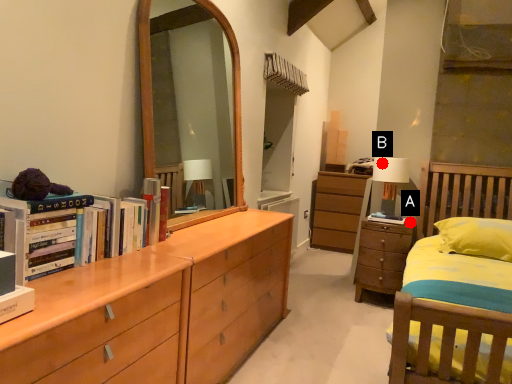
Question: Two points are circled on the image, labeled by A and B beside each circle. Among these points, which one is nearest to the camera?

Choices:
 (A) A is closer
 (B) B is closer

Answer: (A)